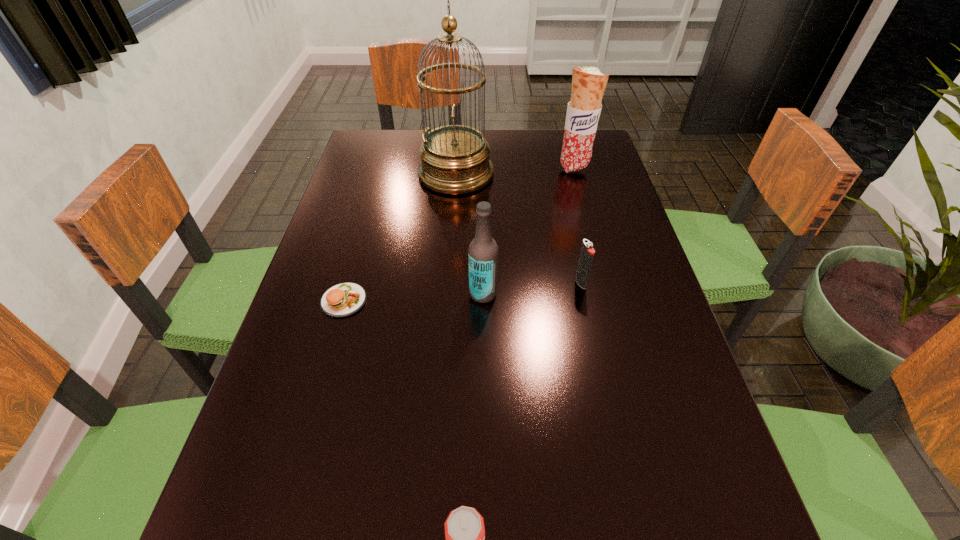
I want to click on the tallest object, so click(x=455, y=159).

I want to click on burrito, so click(x=588, y=84).

I want to click on beer bottle, so click(x=483, y=250).

Locate an element on the screen. The width and height of the screenshot is (960, 540). the third shortest object is located at coordinates (587, 253).

Identify the location of patty. (344, 299).

At what (x,y) coordinates should I click in order to perform the action: click on the leftmost object. Please return your answer as a coordinate pair (x, y). Looking at the image, I should click on (344, 299).

Where is `vacant space located with an open door on the birdcage`? Image resolution: width=960 pixels, height=540 pixels. vacant space located with an open door on the birdcage is located at coordinates [610, 174].

Where is `vacant space located 0.180m on the front of the burrito`? The image size is (960, 540). vacant space located 0.180m on the front of the burrito is located at coordinates (588, 217).

Locate an element on the screen. free region located 0.180m on the side of the fourth shortest object with the label is located at coordinates (384, 293).

Locate an element on the screen. The height and width of the screenshot is (540, 960). vacant region located 0.260m on the side of the fourth shortest object with the label is located at coordinates (347, 293).